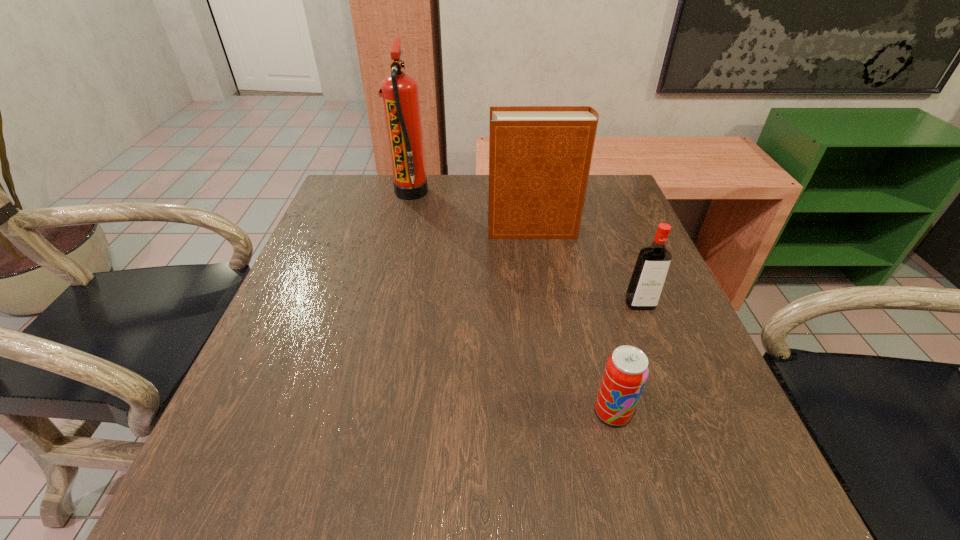
This screenshot has width=960, height=540. Find the location of `vacant area situated 0.050m on the open cover of the third shortest object`. vacant area situated 0.050m on the open cover of the third shortest object is located at coordinates (468, 230).

This screenshot has width=960, height=540. What are the coordinates of `vacant space located 0.060m on the open cover of the third shortest object` in the screenshot? It's located at point(465,230).

You are a GUI agent. You are given a task and a screenshot of the screen. Output one action in this format:
    pyautogui.click(x=<x>, y=<y>)
    Task: Click on the vacant space located 0.400m on the front and back of the second shortest object
    This screenshot has width=960, height=540.
    Given the screenshot: What is the action you would take?
    pyautogui.click(x=727, y=526)

Locate an element on the screen. This screenshot has width=960, height=540. vacant space situated on the left of the soda can is located at coordinates click(402, 412).

Find the location of a particular element. fire extinguisher that is at the far edge is located at coordinates (400, 93).

Where is `hardback book present at the far edge`? hardback book present at the far edge is located at coordinates pos(539,156).

You are a GUI agent. You are given a task and a screenshot of the screen. Output one action in this format:
    pyautogui.click(x=<x>, y=<y>)
    Task: Click on the object at the left edge
    Image resolution: width=960 pixels, height=540 pixels.
    Given the screenshot: What is the action you would take?
    pyautogui.click(x=400, y=93)

The image size is (960, 540). I want to click on hardback book that is at the right edge, so click(539, 156).

At what (x,y) coordinates should I click in order to perform the action: click on vodka situated at the right edge. Please return your answer as a coordinate pair (x, y). The width and height of the screenshot is (960, 540). Looking at the image, I should click on (x=648, y=278).

The image size is (960, 540). What are the coordinates of `soda can that is positioned at the right edge` in the screenshot? It's located at (626, 371).